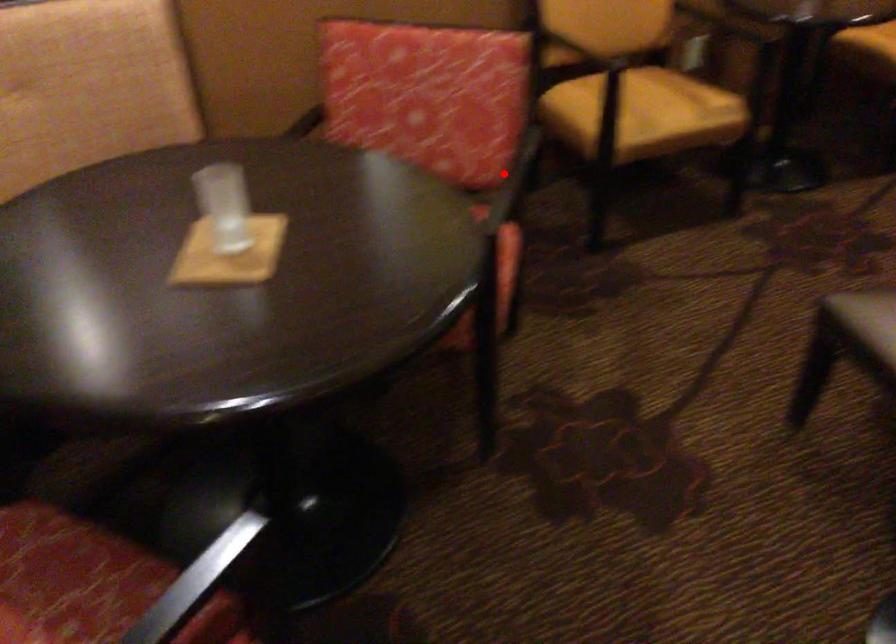
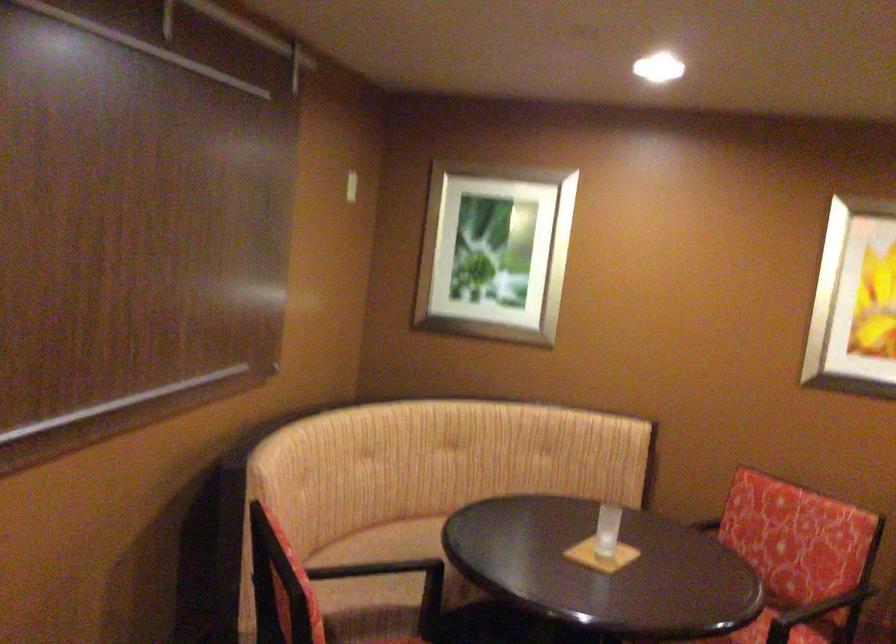
Question: A red point is marked in image1. In image2, is the corresponding 3D point closer to the camera or farther? Reply with the corresponding letter.

Choices:
 (A) The corresponding 3D point is closer.
 (B) The corresponding 3D point is farther.

Answer: (B)